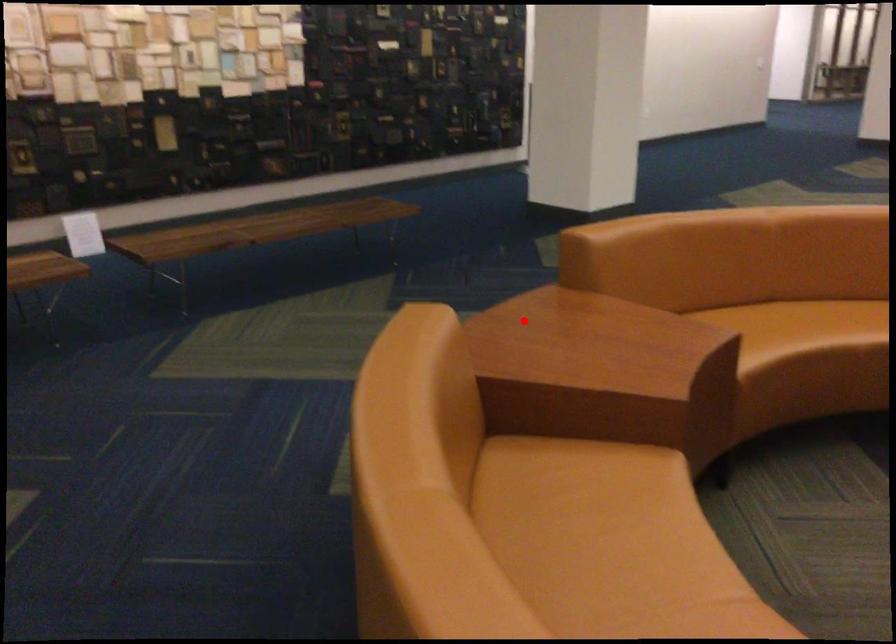
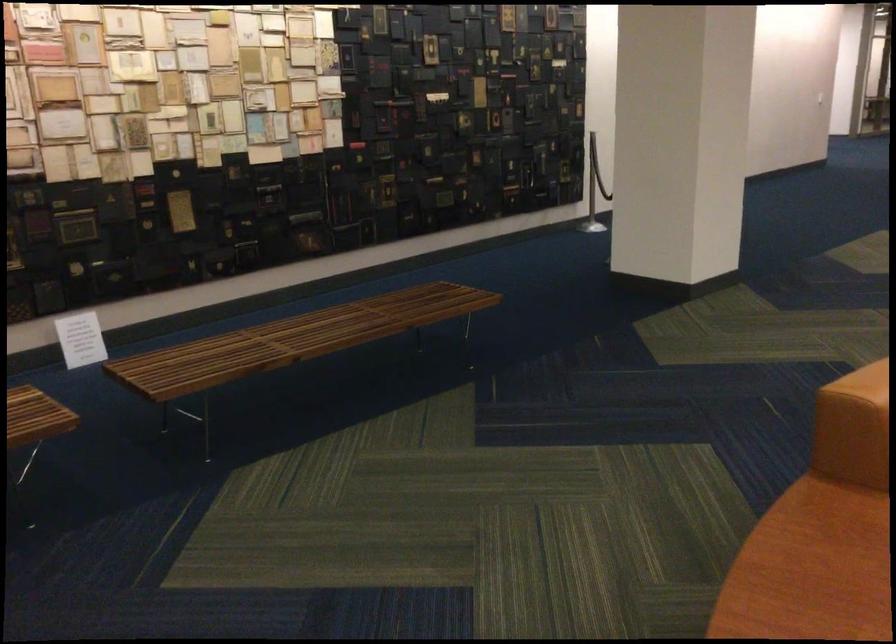
Find the pixel in the second image that matches the highlighted location in the first image.

(808, 570)